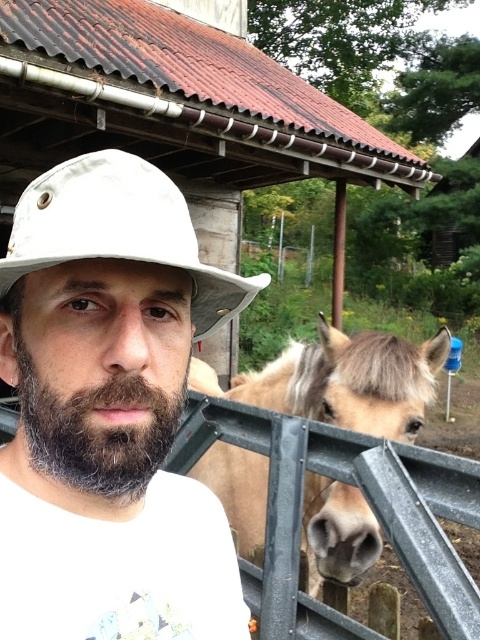
You are a photographer trying to capture a clear shot of both the light brown fur at right and the white matte cowboy hat at center. Based on their sizes, which object would require you to zoom in more to fill the frame?

The light brown fur at right might be wider than the white matte cowboy hat at center, so you might need to zoom in less to capture the light brown fur at right and more to focus on the white matte cowboy hat at center.

You are a photographer trying to capture a clear shot of both the white matte cowboy hat at center and the gray matte beard at center. Which object should you focus on first to ensure both are in focus?

The white matte cowboy hat at center is closer to the viewer than the gray matte beard at center. To ensure both are in focus, you should focus on the white matte cowboy hat at center first, as it is the closer object.

You are standing in the rural scene and want to place a small flag at the point closer to you between point (154,436) and point (129,429). Which point should you choose?

You should choose point (154,436) because it is closer to you than point (129,429).